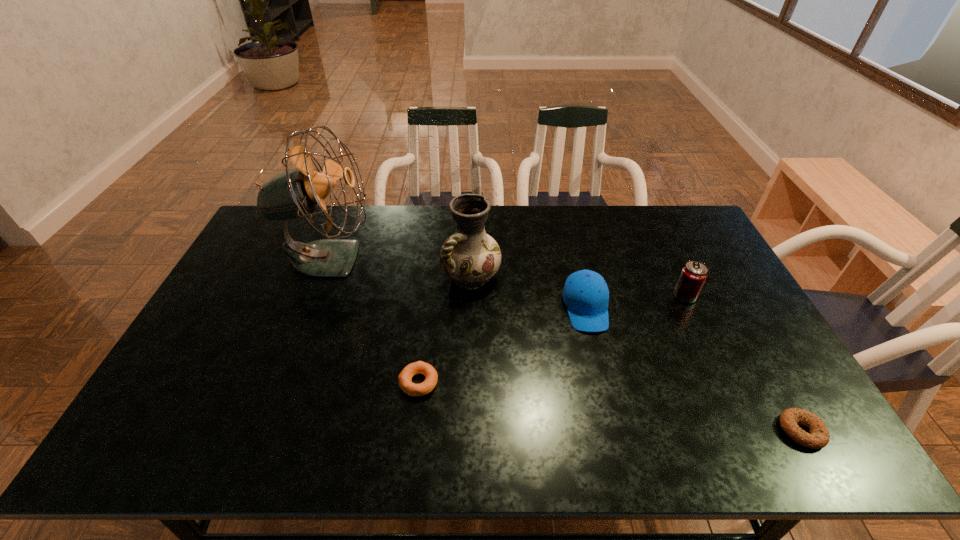
The height and width of the screenshot is (540, 960). I want to click on the nearer bagel, so click(x=818, y=438).

Locate an element on the screen. This screenshot has height=540, width=960. vacant space located 0.240m on the front-facing side of the tallest object for air flow is located at coordinates (445, 258).

Identify the location of vacant space located 0.120m on the right of the vase. This screenshot has width=960, height=540. (538, 275).

Where is `vacant space located 0.210m on the left of the fifth object from left to right`? vacant space located 0.210m on the left of the fifth object from left to right is located at coordinates (606, 296).

Locate an element on the screen. The image size is (960, 540). vacant point located on the front-facing side of the cap is located at coordinates (615, 433).

You are a GUI agent. You are given a task and a screenshot of the screen. Output one action in this format:
    pyautogui.click(x=<x>, y=<y>)
    Task: Click on the vacant space located 0.310m on the back of the left bagel
    
    Given the screenshot: What is the action you would take?
    pyautogui.click(x=430, y=286)

At what (x,y) coordinates should I click in order to perform the action: click on blank space located on the back of the nearer bagel. Please return your answer as a coordinate pair (x, y). Looking at the image, I should click on (737, 317).

Where is `object present at the far edge`? The height and width of the screenshot is (540, 960). object present at the far edge is located at coordinates (295, 193).

Where is `object at the near edge`? The width and height of the screenshot is (960, 540). object at the near edge is located at coordinates (818, 438).

Locate an element on the screen. The height and width of the screenshot is (540, 960). object present at the left edge is located at coordinates (295, 193).